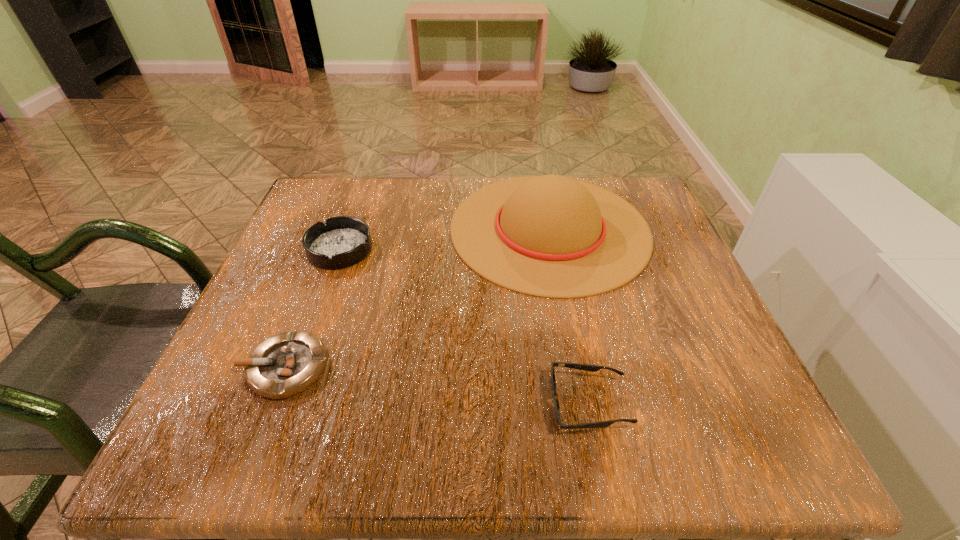
Locate an element on the screen. sombrero located at the far edge is located at coordinates (551, 236).

The image size is (960, 540). I want to click on ashtray that is positioned at the far edge, so click(343, 241).

You are a GUI agent. You are given a task and a screenshot of the screen. Output one action in this format:
    pyautogui.click(x=<x>, y=<y>)
    Task: Click on the object that is at the near edge
    
    Given the screenshot: What is the action you would take?
    point(592,368)

Where is `object present at the right edge`? The height and width of the screenshot is (540, 960). object present at the right edge is located at coordinates tap(551, 236).

Where is `object located in the far left corner section of the desktop`? object located in the far left corner section of the desktop is located at coordinates (343, 241).

The image size is (960, 540). What are the coordinates of `object situated at the far right corner` in the screenshot? It's located at (551, 236).

This screenshot has height=540, width=960. I want to click on vacant space at the far edge, so click(437, 218).

Where is `vacant region at the near edge`? The width and height of the screenshot is (960, 540). vacant region at the near edge is located at coordinates (429, 409).

In the image, there is a desktop. Identify the location of free space at the left edge. The image size is (960, 540). (277, 327).

Where is `free spot at the right edge of the desktop`? free spot at the right edge of the desktop is located at coordinates (712, 321).